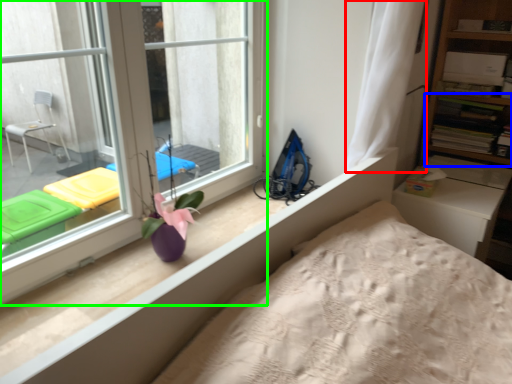
Question: Which object is positioned closest to curtain (highlighted by a red box)? Select from shelf (highlighted by a blue box) and window (highlighted by a green box).

Choices:
 (A) shelf
 (B) window

Answer: (B)